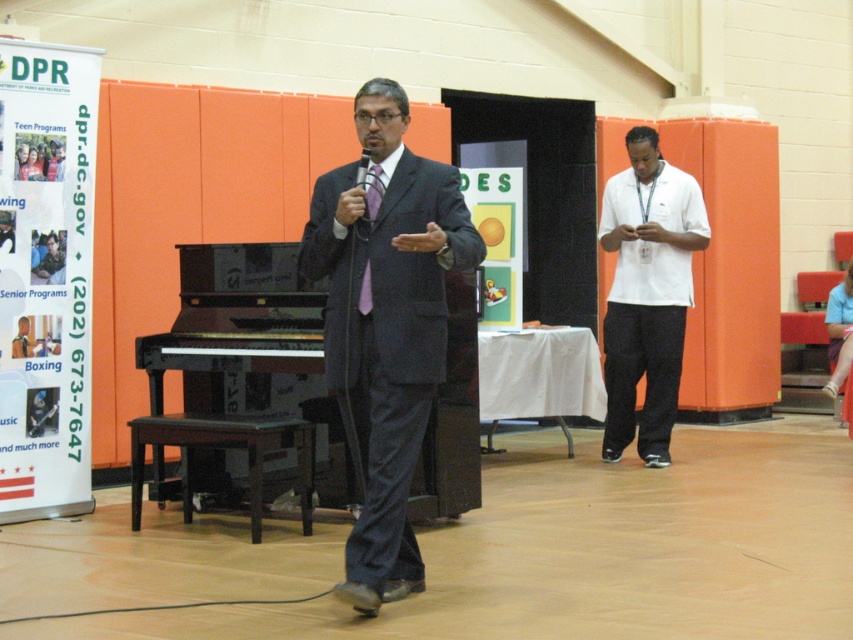
Is matte black suit at center smaller than white cotton shirt at right?

No.

Where is `matte black suit at center`? This screenshot has height=640, width=853. matte black suit at center is located at coordinates (386, 328).

Who is more distant from viewer, [296,252] or [360,307]?

The point [296,252] is more distant.

Is the position of black polished piano at center more distant than that of purple satin tie at center?

Yes, it is behind purple satin tie at center.

Between point (230, 273) and point (375, 189), which one is positioned in front?

Point (375, 189) is more forward.

At what (x,y) coordinates should I click in order to perform the action: click on black polished piano at center. Please return your answer as a coordinate pair (x, y). This screenshot has width=853, height=640. Looking at the image, I should click on (235, 323).

Which is above, white cotton shirt at right or black polished piano at center?

Positioned higher is white cotton shirt at right.

Which is in front, point (659, 406) or point (202, 257)?

Positioned in front is point (202, 257).

Identify the location of white cotton shirt at right. (647, 292).